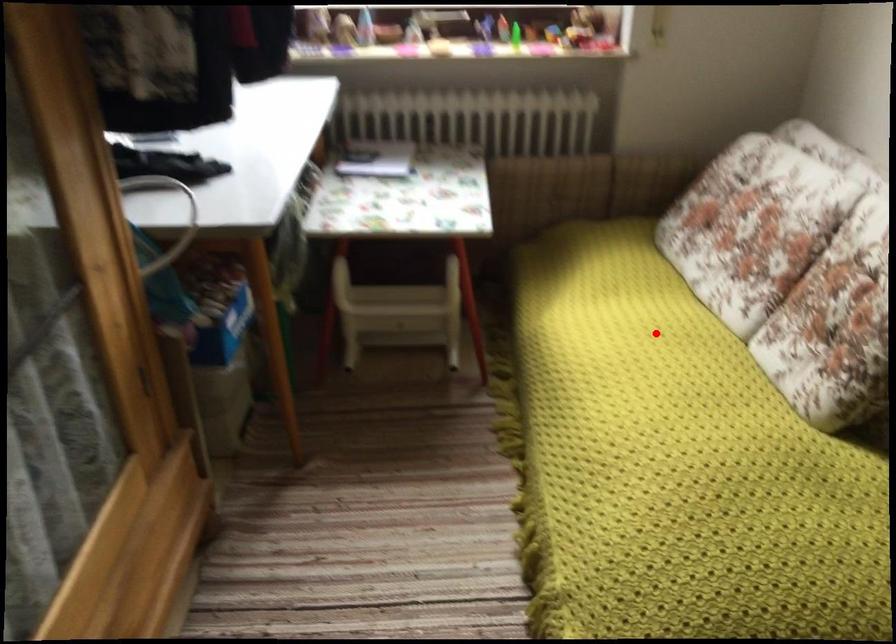
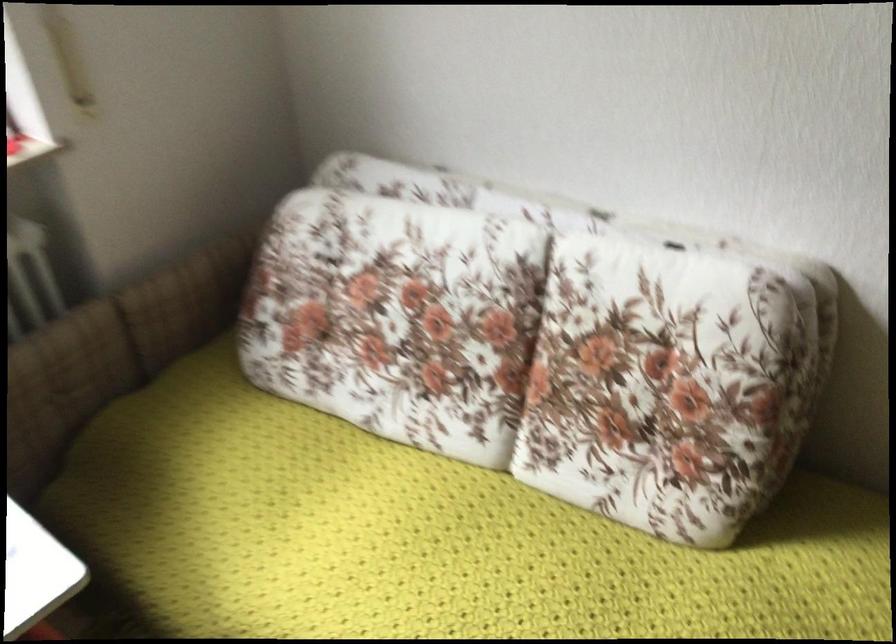
Locate, in the second image, the point that corresponds to the highlighted location in the first image.

(429, 538)